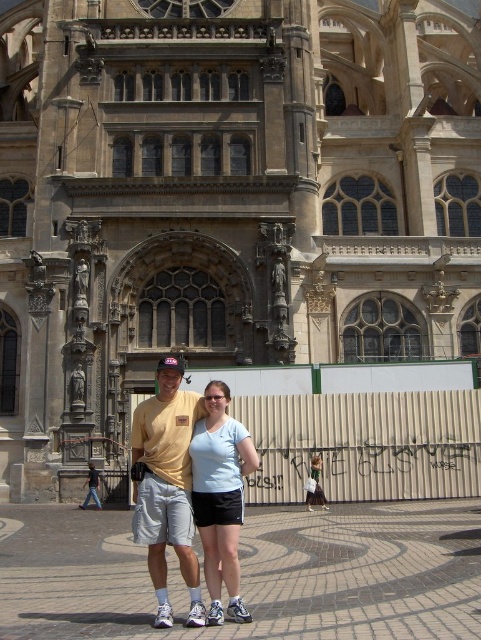
You are taking a photo of two people standing in front of a grand Gothic building. The first person is wearing a yellow tshirt and is pointing at point (161, 401). The second person is wearing a light blue tshirt and is pointing at point (206, 458). Which person is closer to the building?

The person pointing at point (206, 458) is closer to the building because point (161, 401) is behind point (206, 458).